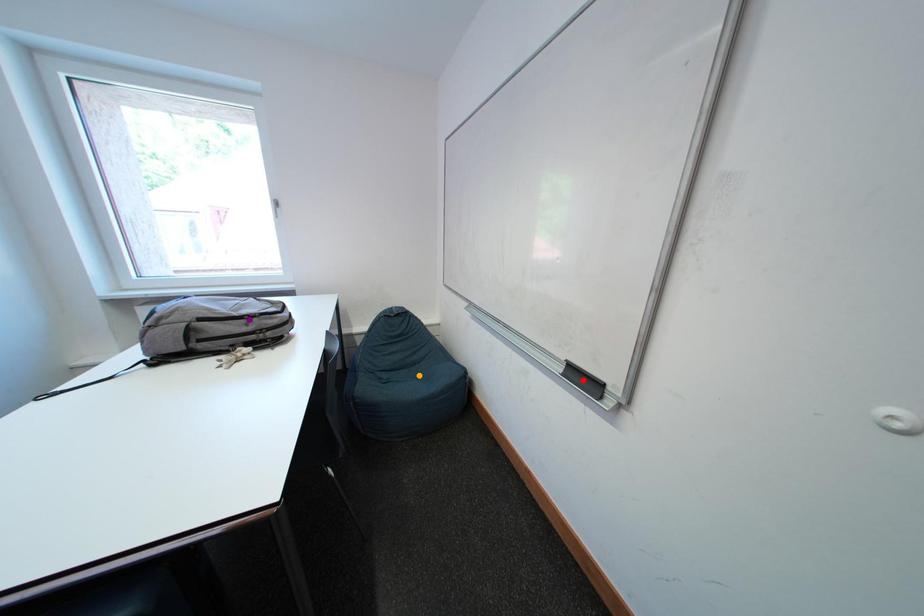
Order these from nearest to farthest:
purple point
red point
orange point

red point
purple point
orange point